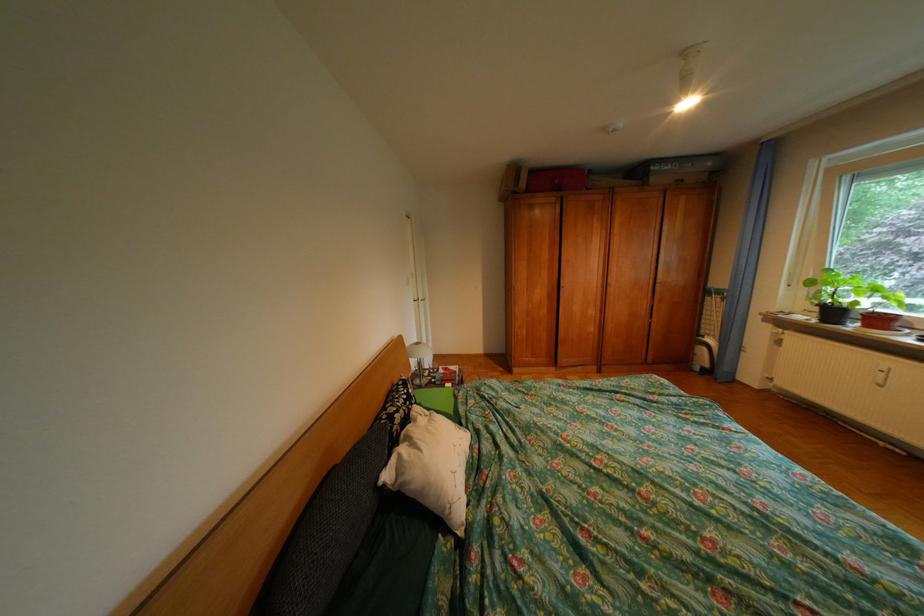
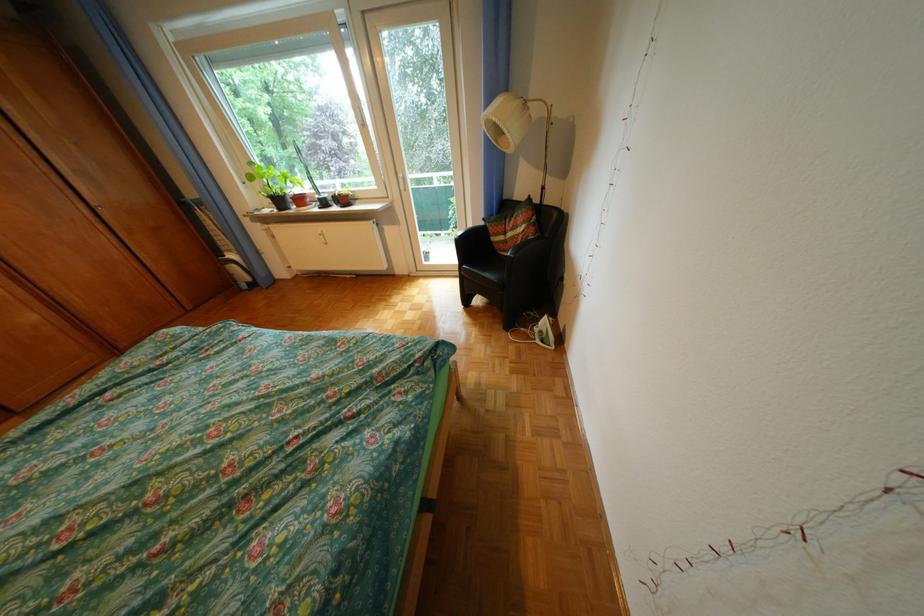
Where in the second image is the point corresponding to (832,310) from the first image?

(284, 201)